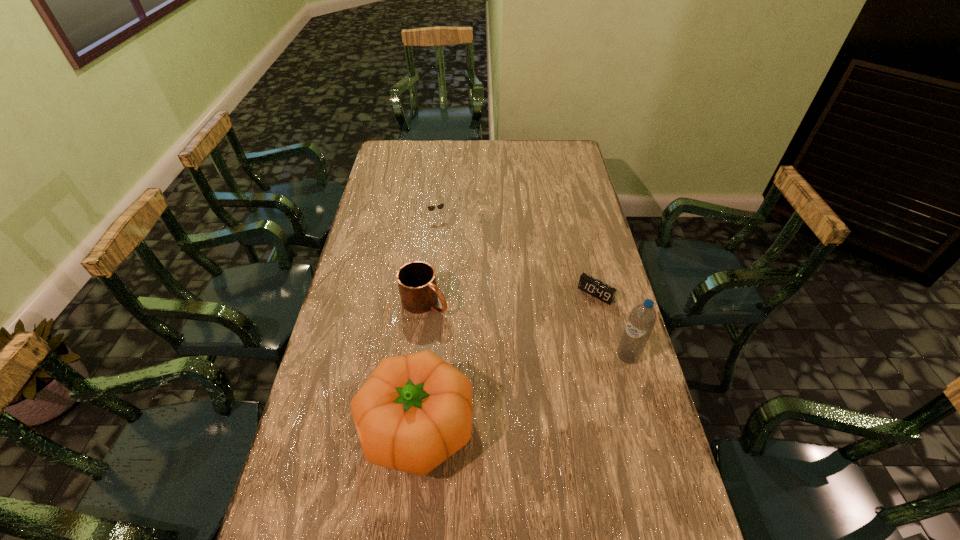
Locate an element on the screen. The height and width of the screenshot is (540, 960). free spot on the desktop that is between the nearest object and the water bottle and is positioned on the front-facing side of the alarm clock is located at coordinates (510, 396).

At what (x,y) coordinates should I click in order to perform the action: click on free space on the desktop that is between the nearest object and the second nearest object and is positioned on the side of the mug with the handle. Please return your answer as a coordinate pair (x, y). The width and height of the screenshot is (960, 540). Looking at the image, I should click on (545, 384).

What are the coordinates of `free space on the desktop that is between the pumpkin and the water bottle and is positioned in front of the lenses of the second shortest object` in the screenshot? It's located at (515, 394).